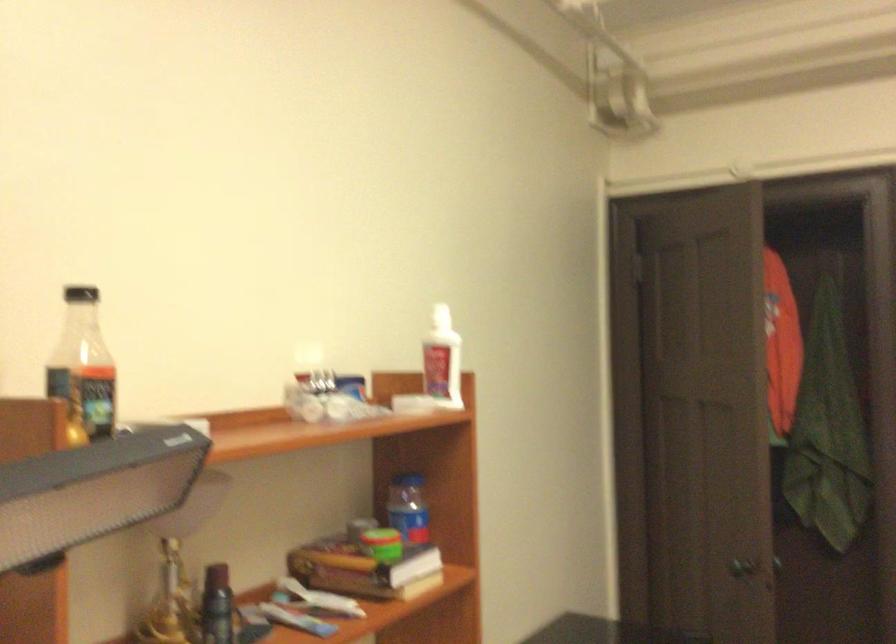
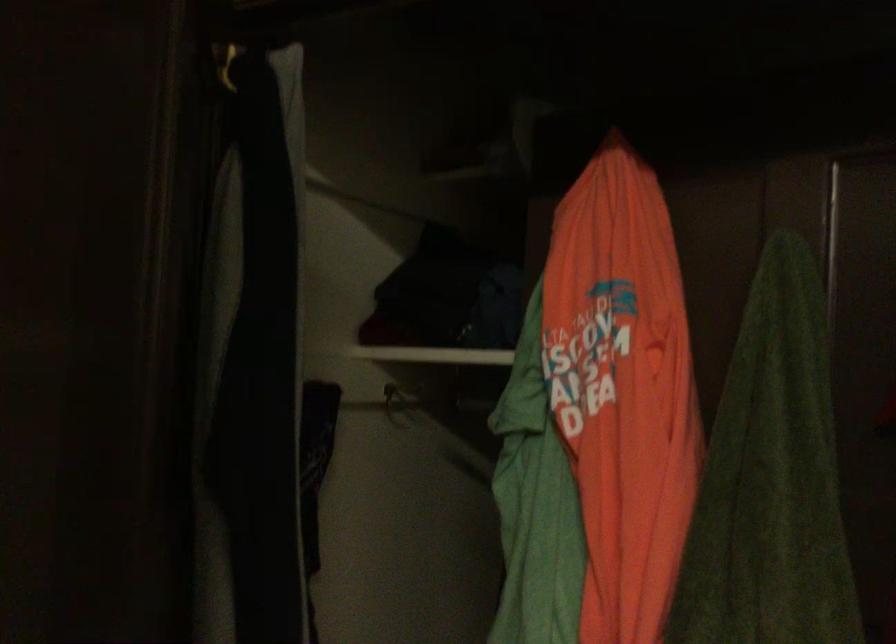
The images are taken continuously from a first-person perspective. In which direction are you moving?

The cameraman moved toward right, forward.